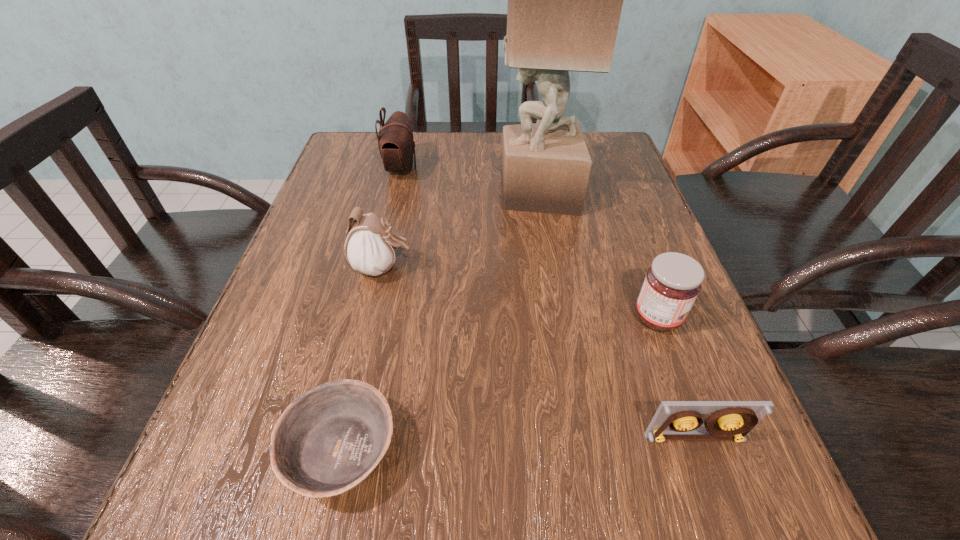
This screenshot has width=960, height=540. Identify the location of sculpture. (565, 0).

Find the location of a particular element. The image size is (960, 540). the third object from right to left is located at coordinates point(565,0).

Identify the location of the farther pouch. The height and width of the screenshot is (540, 960). (396, 144).

Where is `the third farthest object`? The width and height of the screenshot is (960, 540). the third farthest object is located at coordinates click(371, 245).

What are the coordinates of `the third nearest object` in the screenshot? It's located at (672, 283).

This screenshot has width=960, height=540. Find the location of `videotape`. videotape is located at coordinates (730, 420).

The image size is (960, 540). I want to click on bowl, so click(329, 440).

Where is `free space located on the front-facing side of the sculpture`? This screenshot has width=960, height=540. free space located on the front-facing side of the sculpture is located at coordinates (472, 193).

Find the location of `free region located 0.350m on the front-facing side of the sculpture`. free region located 0.350m on the front-facing side of the sculpture is located at coordinates point(347,193).

In order to click on free space located on the front-facing side of the sculpture in this screenshot , I will do `click(407, 193)`.